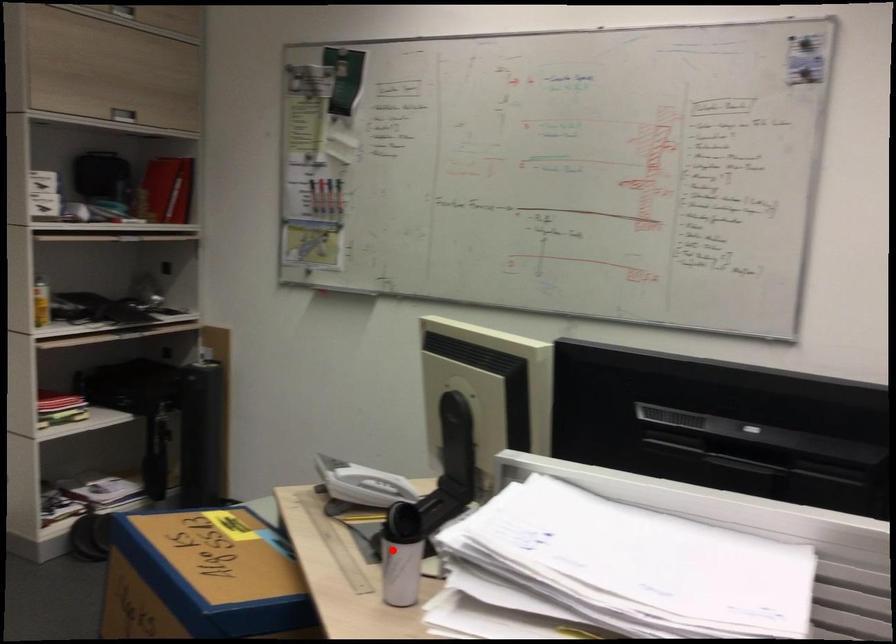
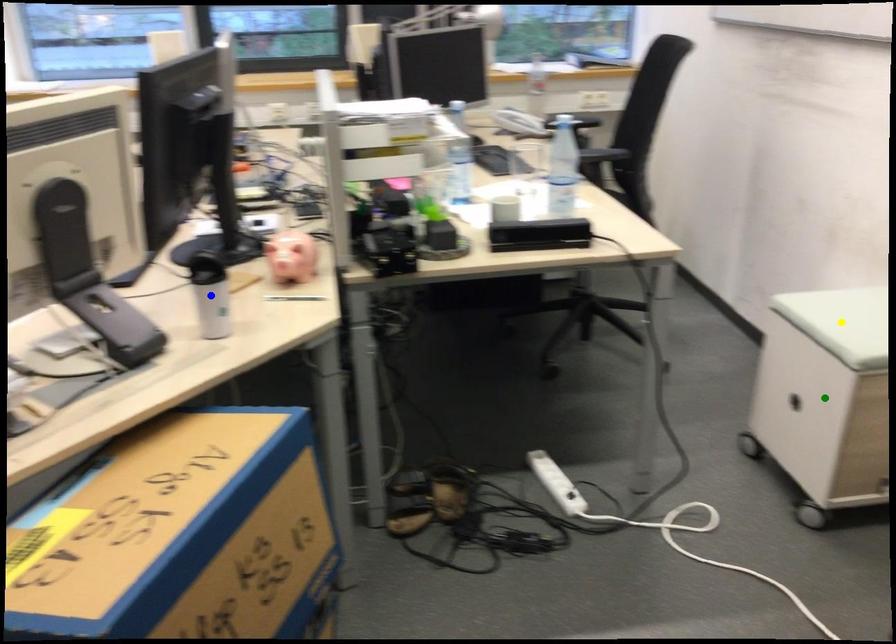
Question: I am providing you with two images of the same scene from different viewpoints. A red point is marked on the first image. You are given multiple points on the second image. Can you choose the point in image 2 that corresponds to the point in image 1?

Choices:
 (A) green point
 (B) blue point
 (C) yellow point

Answer: (B)